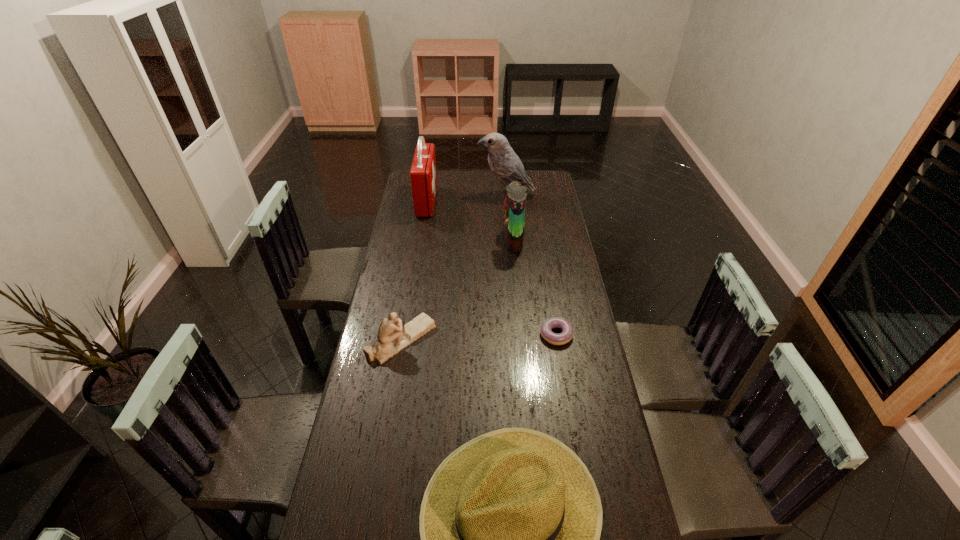
Identify the location of free space between the second shortest object and the shorter parrot. The width and height of the screenshot is (960, 540). (457, 290).

Point out which object is positioned as the nearest to the farther parrot. Please provide its 2D coordinates. Your answer should be formatted as a tuple, i.e. [(x, y)], where the tuple contains the x and y coordinates of a point satisfying the conditions above.

[(514, 204)]

You are a GUI agent. You are given a task and a screenshot of the screen. Output one action in this format:
    pyautogui.click(x=<x>, y=<y>)
    Task: Click on the object that is the second nearest to the fourth tallest object
    The width and height of the screenshot is (960, 540).
    Given the screenshot: What is the action you would take?
    pyautogui.click(x=546, y=328)

Find the location of a particular element. free location that satisfies the following two spatial constraints: 1. on the front face of the shortest object; 2. on the right side of the first-aid kit is located at coordinates (404, 334).

The width and height of the screenshot is (960, 540). In order to click on vacant area that satisfies the following two spatial constraints: 1. on the front-facing side of the taller parrot; 2. on the left side of the doughnut in this screenshot , I will do 517,334.

Where is `free region that satisfies the following two spatial constraints: 1. at the face of the fourth shortest object; 2. on the right side of the doughnut`? free region that satisfies the following two spatial constraints: 1. at the face of the fourth shortest object; 2. on the right side of the doughnut is located at coordinates (521, 334).

Where is `vacant area in the image that satisfies the following two spatial constraints: 1. on the back side of the doughnut; 2. at the face of the nearer parrot`? vacant area in the image that satisfies the following two spatial constraints: 1. on the back side of the doughnut; 2. at the face of the nearer parrot is located at coordinates (540, 240).

This screenshot has height=540, width=960. Find the location of `vacant space that satisfies the following two spatial constraints: 1. at the face of the shortest object; 2. on the right side of the nearer parrot`. vacant space that satisfies the following two spatial constraints: 1. at the face of the shortest object; 2. on the right side of the nearer parrot is located at coordinates (521, 334).